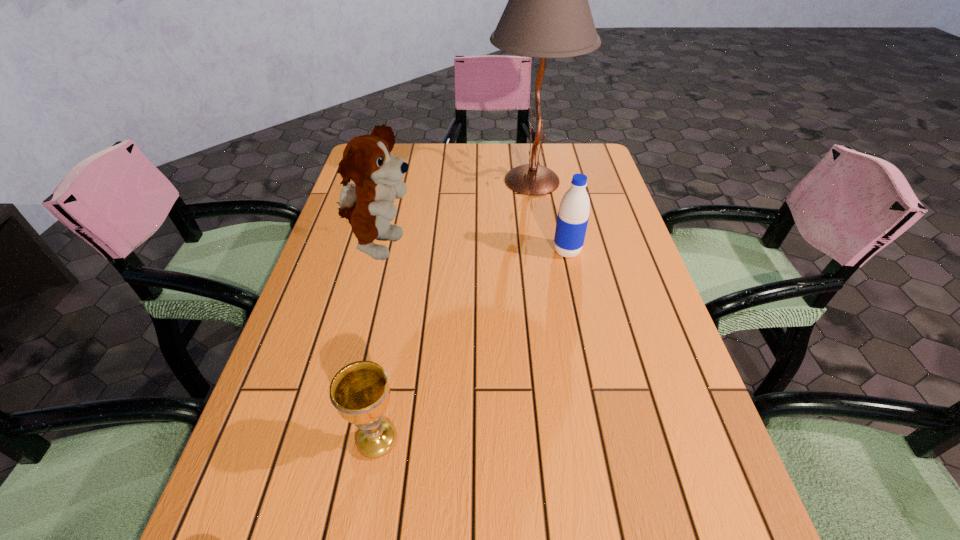
You are a GUI agent. You are given a task and a screenshot of the screen. Output one action in this format:
    pyautogui.click(x=<x>, y=<y>)
    Task: Click on the free location located on the left of the third tallest object
    This screenshot has height=540, width=960.
    Given the screenshot: What is the action you would take?
    pyautogui.click(x=401, y=251)

What are the coordinates of `blank space located on the back of the shortest object` in the screenshot? It's located at (391, 358).

This screenshot has height=540, width=960. I want to click on object present at the far edge, so click(548, 15).

Locate an element on the screen. This screenshot has width=960, height=540. object located at the left edge is located at coordinates (367, 203).

Identify the location of table lamp present at the right edge. The image size is (960, 540). (548, 15).

Where is `water bottle situated at the right edge`? Image resolution: width=960 pixels, height=540 pixels. water bottle situated at the right edge is located at coordinates (573, 215).

The image size is (960, 540). Identify the location of object at the far right corner. (548, 15).

In order to click on free space at the far edge in this screenshot , I will do `click(470, 163)`.

Locate an element on the screen. Image resolution: width=960 pixels, height=540 pixels. vacant space at the left edge of the desktop is located at coordinates (319, 258).

Find the location of a particular element. The height and width of the screenshot is (540, 960). vacant space at the right edge of the desktop is located at coordinates (666, 436).